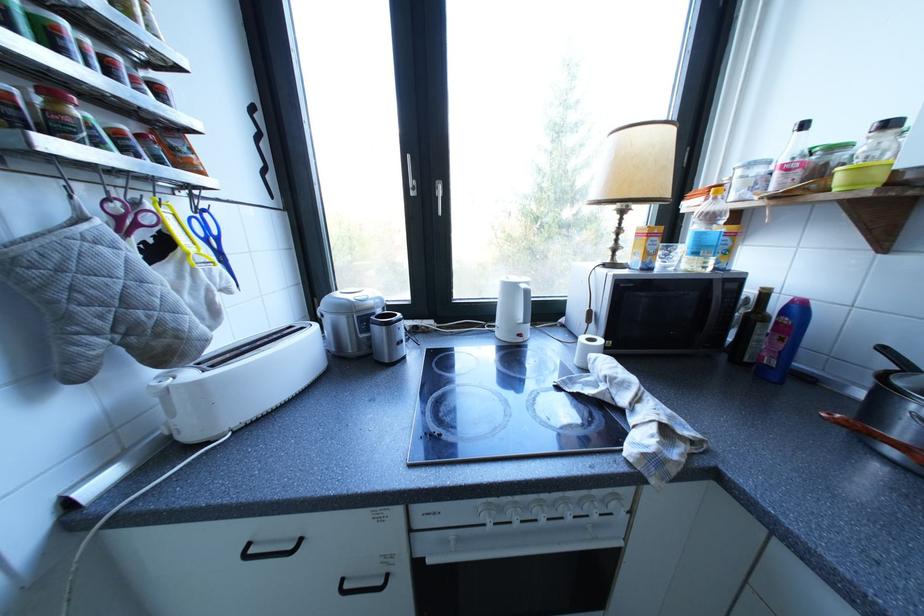
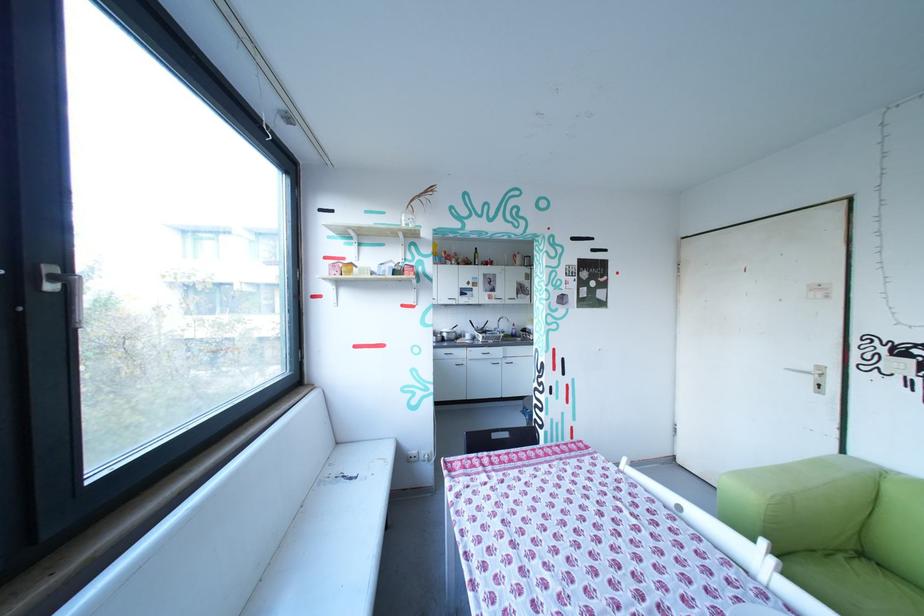
Question: I am providing you with two images of the same scene from different viewpoints. Which of the following objects are not visible in image2?

Choices:
 (A) bottle with yellow cap
 (B) sofa sitting surface
 (C) cream trash can
 (D) dark glass bottle

Answer: (D)